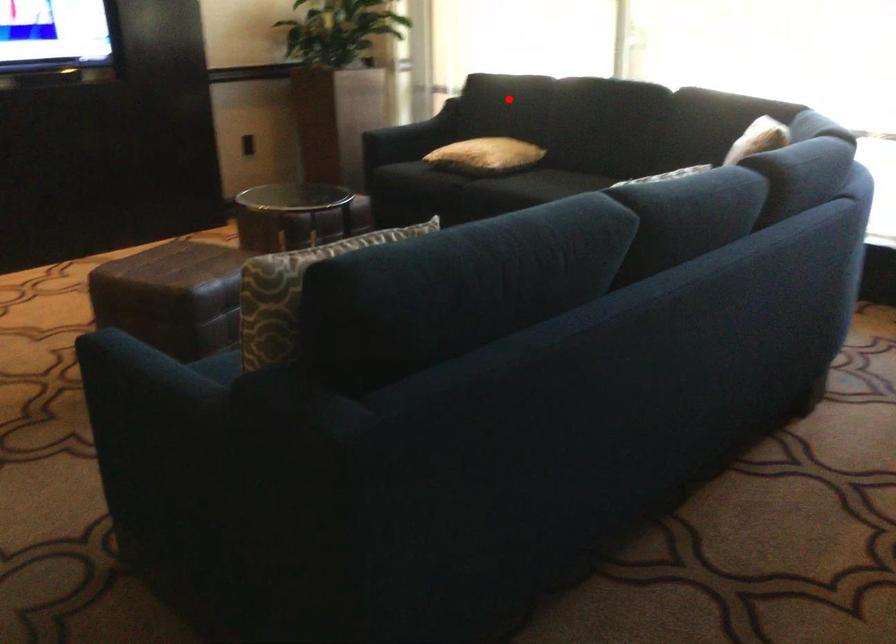
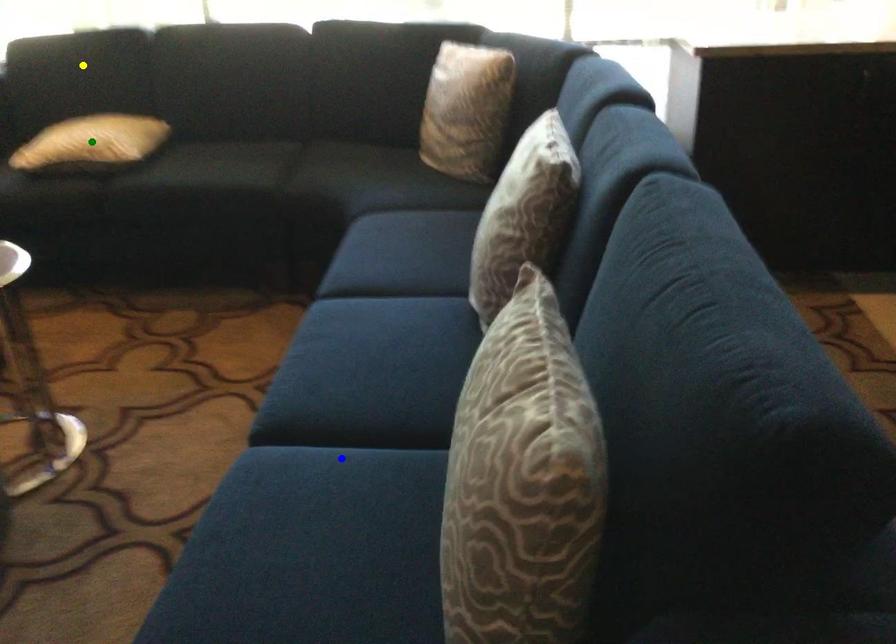
Question: I am providing you with two images of the same scene from different viewpoints. A red point is marked on the first image. You are given multiple points on the second image. Can you choose the point in image 2 that corresponds to the point in image 1?

Choices:
 (A) green point
 (B) yellow point
 (C) blue point

Answer: (B)